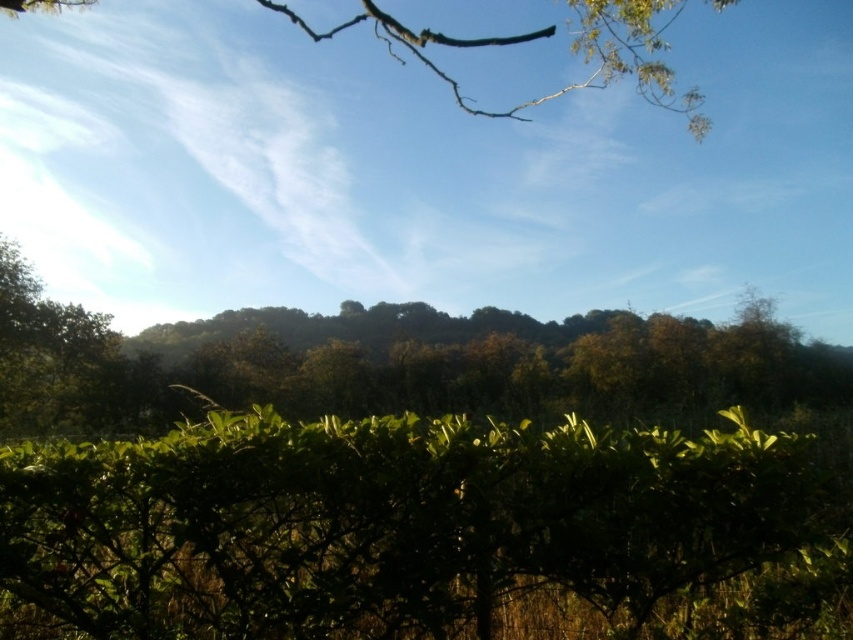
Is green leafy hedge at lower center positioned behind green leafy branch at upper center?

No, it is in front of green leafy branch at upper center.

Describe the element at coordinates (412, 529) in the screenshot. I see `green leafy hedge at lower center` at that location.

Is point (469, 595) closer to viewer compared to point (650, 24)?

Yes, it is in front of point (650, 24).

Where is `green leafy hedge at lower center`? green leafy hedge at lower center is located at coordinates (412, 529).